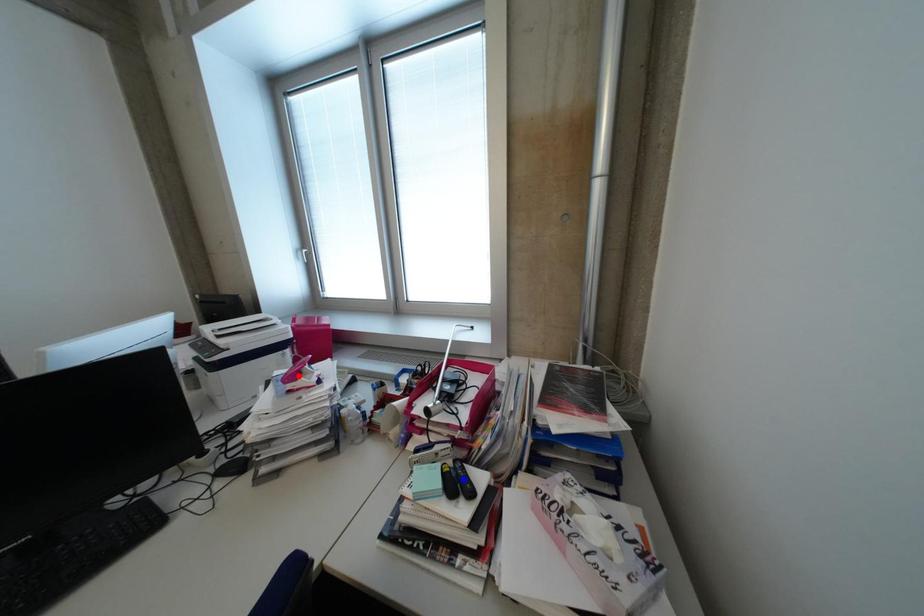
Question: In the image, two points are highlighted. Which point is nearer to the camera? Reply with the corresponding letter.

Choices:
 (A) blue point
 (B) red point

Answer: (A)